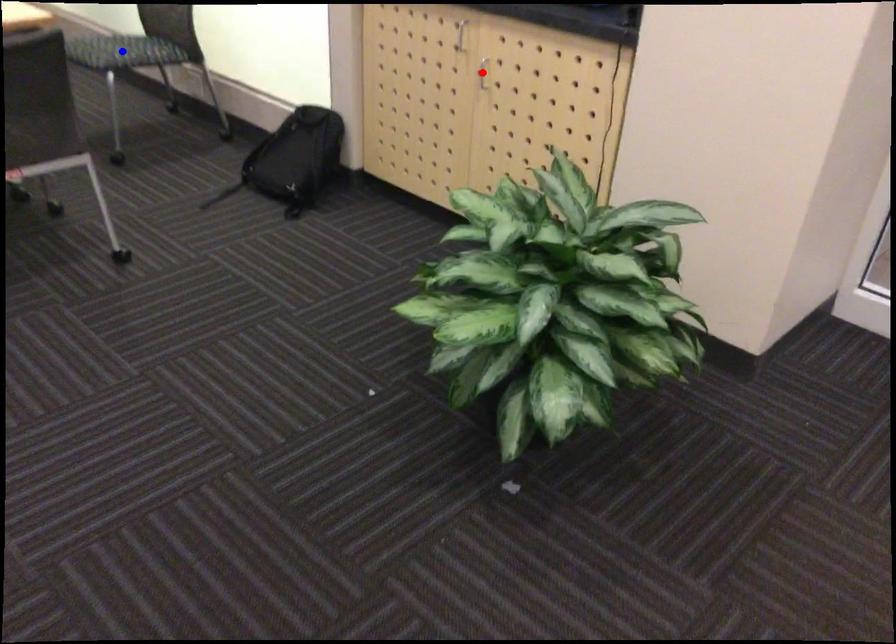
Question: Two points are marked on the image. Which point is closer to the camera?

Choices:
 (A) Blue point is closer.
 (B) Red point is closer.

Answer: (B)